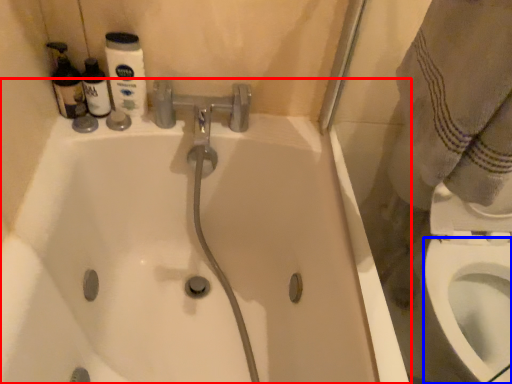
Question: Among these objects, which one is nearest to the camera, bathtub (highlighted by a red box) or bidet (highlighted by a blue box)?

Choices:
 (A) bathtub
 (B) bidet

Answer: (A)